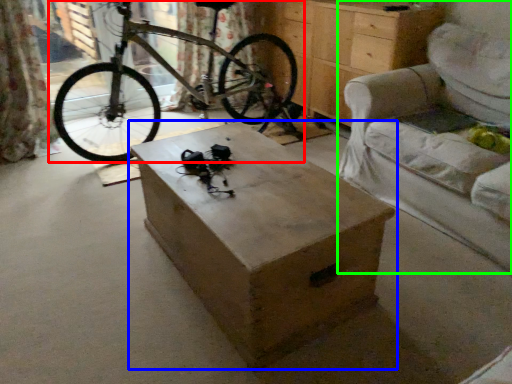
Question: Considering the real-world distances, which object is closest to bicycle (highlighted by a red box)? table (highlighted by a blue box) or armchair (highlighted by a green box).

Choices:
 (A) table
 (B) armchair

Answer: (A)